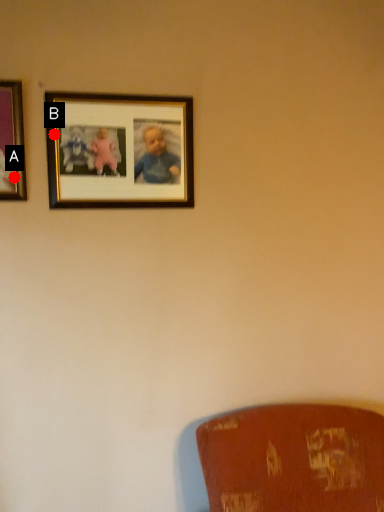
Question: Two points are circled on the image, labeled by A and B beside each circle. Which point appears farthest from the camera in this image?

Choices:
 (A) A is further
 (B) B is further

Answer: (B)